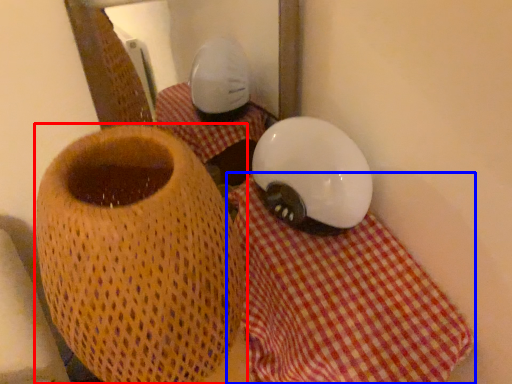
Question: Which object appears farthest to the camera in this image, vase (highlighted by a red box) or tablecloth (highlighted by a blue box)?

Choices:
 (A) vase
 (B) tablecloth

Answer: (B)